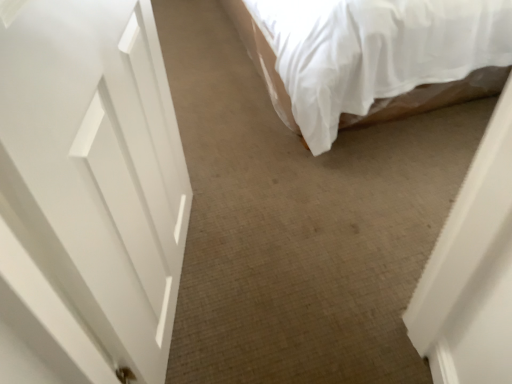
Locate an element on the screen. white glossy door at left is located at coordinates (96, 168).

Describe the element at coordinates (96, 168) in the screenshot. This screenshot has width=512, height=384. I see `white glossy door at left` at that location.

The height and width of the screenshot is (384, 512). I want to click on white fabric bed at upper right, so click(x=265, y=46).

The height and width of the screenshot is (384, 512). What do you see at coordinates (265, 46) in the screenshot?
I see `white fabric bed at upper right` at bounding box center [265, 46].

You are a GUI agent. You are given a task and a screenshot of the screen. Output one action in this format:
    pyautogui.click(x=<x>, y=<y>)
    Task: Click on the white glossy door at left
    The width and height of the screenshot is (512, 384).
    Given the screenshot: What is the action you would take?
    pyautogui.click(x=96, y=168)

Which is more to the left, white fabric bed at upper right or white glossy door at left?

white glossy door at left.

Considering the positions of objects white fabric bed at upper right and white glossy door at left in the image provided, who is behind, white fabric bed at upper right or white glossy door at left?

Positioned behind is white fabric bed at upper right.

Does point (442, 101) come behind point (2, 129)?

Yes.

From the image's perspective, between white fabric bed at upper right and white glossy door at left, who is located below?

From the image's view, white glossy door at left is below.

From a real-world perspective, which object stands above the other?

white glossy door at left is physically above.

Between white fabric bed at upper right and white glossy door at left, which one has smaller width?

white glossy door at left.

From the picture: Is white fabric bed at upper right taller or shorter than white glossy door at left?

Clearly, white fabric bed at upper right is shorter compared to white glossy door at left.

Consider the image. Considering the relative sizes of white fabric bed at upper right and white glossy door at left in the image provided, is white fabric bed at upper right smaller than white glossy door at left?

Actually, white fabric bed at upper right might be larger than white glossy door at left.

Consider the image. Is white fabric bed at upper right not inside white glossy door at left?

Absolutely, white fabric bed at upper right is external to white glossy door at left.

Looking at this image, is white fabric bed at upper right placed right next to white glossy door at left?

No, white fabric bed at upper right is not touching white glossy door at left.

Is white glossy door at left at the back of white fabric bed at upper right?

No, white glossy door at left is not at the back of white fabric bed at upper right.

How many degrees apart are the facing directions of white fabric bed at upper right and white glossy door at left?

The angular difference between white fabric bed at upper right and white glossy door at left is 71.3 degrees.

Identify the location of bed directly beneath the white glossy door at left (from a real-world perspective). This screenshot has height=384, width=512. (265, 46).

Is white glossy door at left at the left side of white fabric bed at upper right?

Yes.

Is white glossy door at left closer to the viewer compared to white fabric bed at upper right?

Yes, the depth of white glossy door at left is less than that of white fabric bed at upper right.

Between point (153, 371) and point (282, 83), which one is positioned behind?

The point (282, 83) is behind.

From the image's perspective, which is above, white glossy door at left or white fabric bed at upper right?

white fabric bed at upper right appears higher in the image.

From a real-world perspective, which is physically below, white glossy door at left or white fabric bed at upper right?

white fabric bed at upper right, from a real-world perspective.

Is white glossy door at left thinner than white fabric bed at upper right?

Yes.

Does white glossy door at left have a lesser height compared to white fabric bed at upper right?

In fact, white glossy door at left may be taller than white fabric bed at upper right.

In terms of size, does white glossy door at left appear bigger or smaller than white fabric bed at upper right?

In the image, white glossy door at left appears to be smaller than white fabric bed at upper right.

Does white glossy door at left contain white fabric bed at upper right?

No, white fabric bed at upper right is not surrounded by white glossy door at left.

Does white glossy door at left touch white fabric bed at upper right?

No, white glossy door at left is not touching white fabric bed at upper right.

Consider the image. Is white glossy door at left aimed at white fabric bed at upper right?

No, white glossy door at left is not aimed at white fabric bed at upper right.

How different are the orientations of white glossy door at left and white fabric bed at upper right in degrees?

The facing directions of white glossy door at left and white fabric bed at upper right are 71.3 degrees apart.

Find the location of a particular element. The width and height of the screenshot is (512, 384). bed behind the white glossy door at left is located at coordinates (265, 46).

This screenshot has width=512, height=384. Find the location of `door above the white fabric bed at upper right (from a real-world perspective)`. door above the white fabric bed at upper right (from a real-world perspective) is located at coordinates (96, 168).

Locate an element on the screen. bed that appears behind the white glossy door at left is located at coordinates (265, 46).